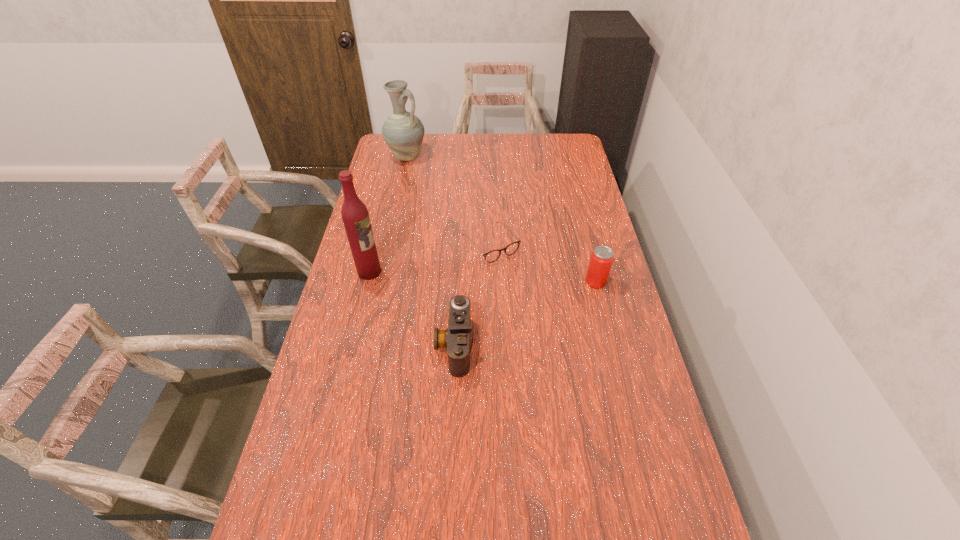
You are a GUI agent. You are given a task and a screenshot of the screen. Output one action in this format:
    pyautogui.click(x=<x>, y=<y>)
    Task: Click on the camera
    The image size is (960, 540).
    Given the screenshot: What is the action you would take?
    pyautogui.click(x=456, y=338)

What are the coordinates of `the second shortest object` in the screenshot? It's located at (456, 338).

Locate an element on the screen. The image size is (960, 540). can is located at coordinates (601, 260).

Where is `the rightmost object`? the rightmost object is located at coordinates (601, 260).

At what (x,y) coordinates should I click in order to perform the action: click on spectacles. Please return your answer as a coordinate pair (x, y). The height and width of the screenshot is (540, 960). Looking at the image, I should click on (492, 256).

Find the location of a particular element. pitcher is located at coordinates (403, 132).

The height and width of the screenshot is (540, 960). What are the coordinates of `the farthest object` in the screenshot? It's located at (403, 132).

Identify the location of liquor. pos(355,216).

In order to click on vacant space located 0.160m on the lens of the second shortest object in this screenshot , I will do `click(382, 345)`.

Where is `vacant region located on the lens of the second shortest object`? The image size is (960, 540). vacant region located on the lens of the second shortest object is located at coordinates (385, 345).